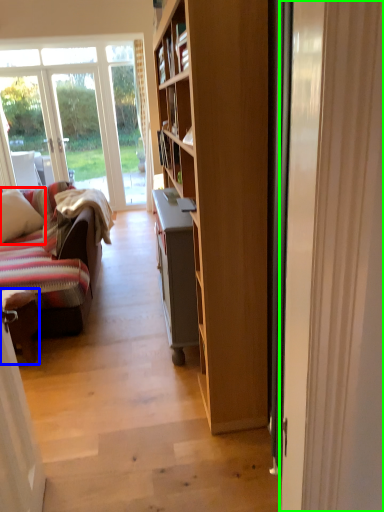
Question: Based on their relative distances, which object is farther from pillow (highlighted by a red box)? Choose from chair (highlighted by a blue box) and door (highlighted by a green box).

Choices:
 (A) chair
 (B) door

Answer: (B)